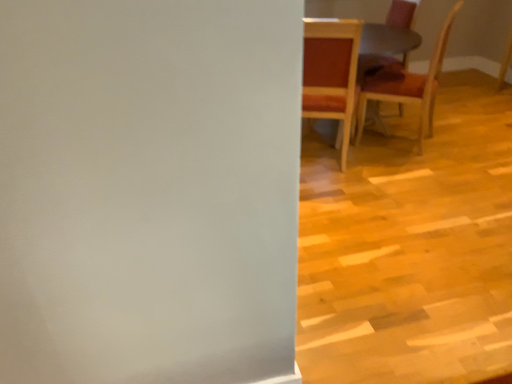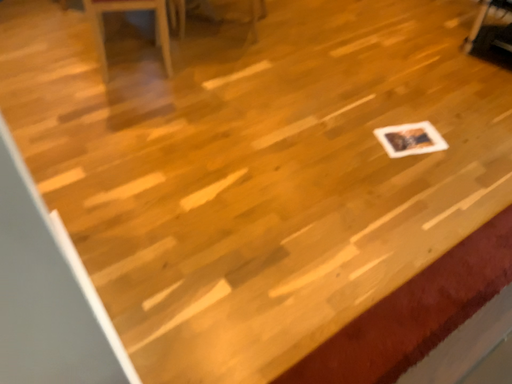
Question: Which way did the camera rotate in the video?

Choices:
 (A) rotated upward
 (B) rotated downward

Answer: (B)